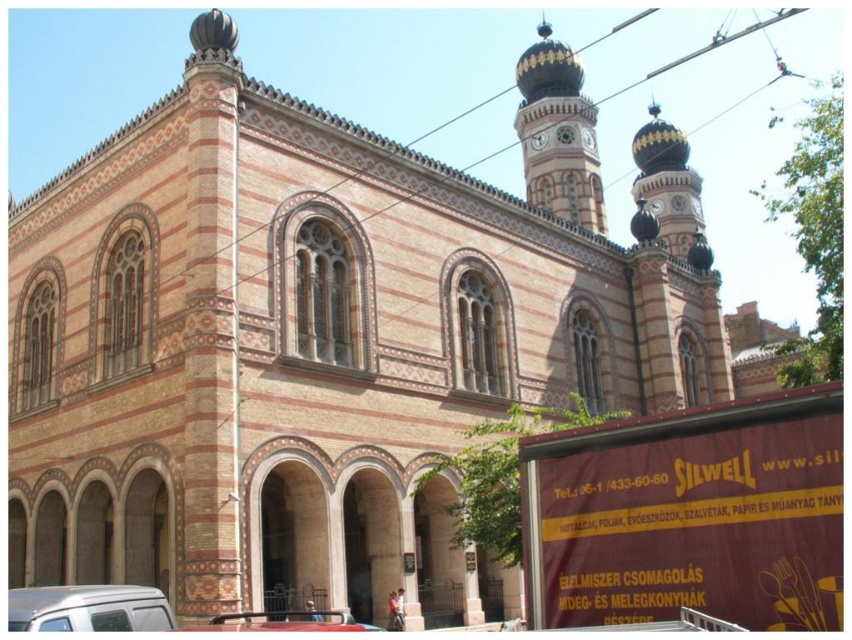
Question: Which object appears farthest from the camera in this image?

Choices:
 (A) white matte van at lower left
 (B) metallic silver car at lower center

Answer: (B)

Question: Can you confirm if white matte van at lower left is thinner than metallic silver car at lower center?

Choices:
 (A) yes
 (B) no

Answer: (B)

Question: Which point is farther to the camera?

Choices:
 (A) (262, 621)
 (B) (87, 616)

Answer: (A)

Question: Observing the image, what is the correct spatial positioning of white matte van at lower left in reference to metallic silver car at lower center?

Choices:
 (A) left
 (B) right

Answer: (A)

Question: Which object appears farthest from the camera in this image?

Choices:
 (A) metallic silver car at lower center
 (B) white matte van at lower left

Answer: (A)

Question: Is white matte van at lower left positioned in front of metallic silver car at lower center?

Choices:
 (A) yes
 (B) no

Answer: (A)